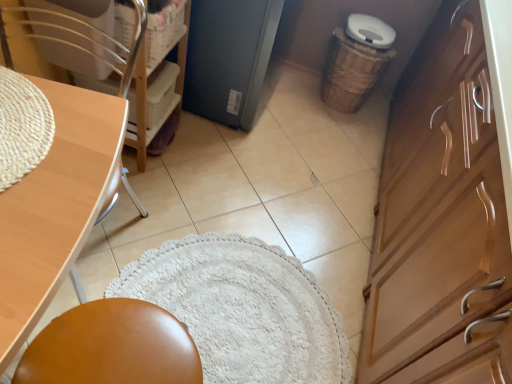
Find the location of a particular element. vacant space that is in between matte black refrigerator at center and woven brown basket at right, marked as the second basket in a left-to-right arrangement is located at coordinates (298, 109).